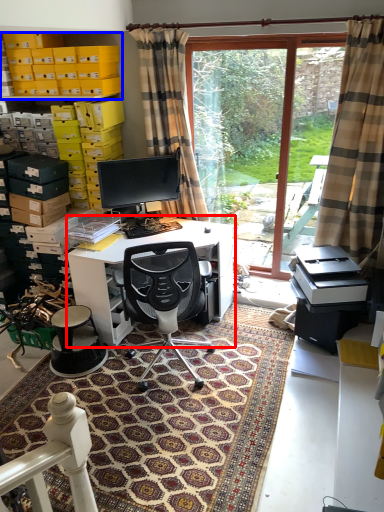
Question: Among these objects, which one is farthest to the camera, desk (highlighted by a red box) or shelf (highlighted by a blue box)?

Choices:
 (A) desk
 (B) shelf

Answer: (B)